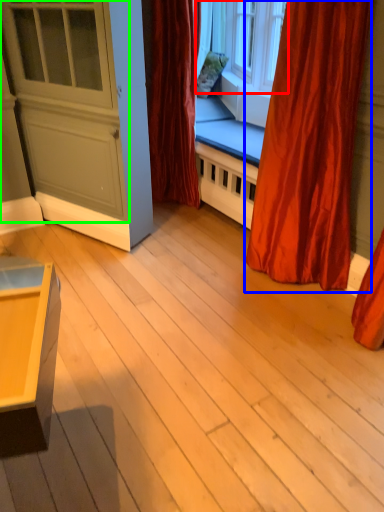
Question: Which is nearer to the window (highlighted by a red box)? curtain (highlighted by a blue box) or screen door (highlighted by a green box).

Choices:
 (A) curtain
 (B) screen door

Answer: (A)